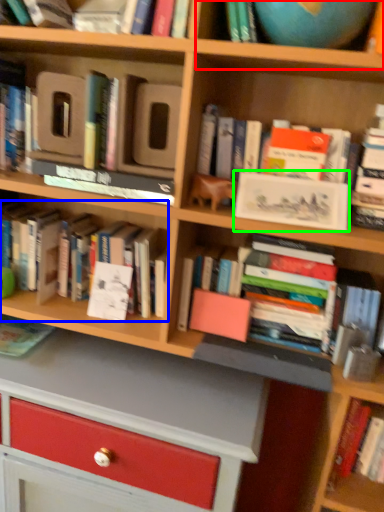
Question: Which object is positioned farthest from shelf (highlighted by a red box)? Select from book (highlighted by a blue box) and paperback book (highlighted by a green box).

Choices:
 (A) book
 (B) paperback book

Answer: (A)